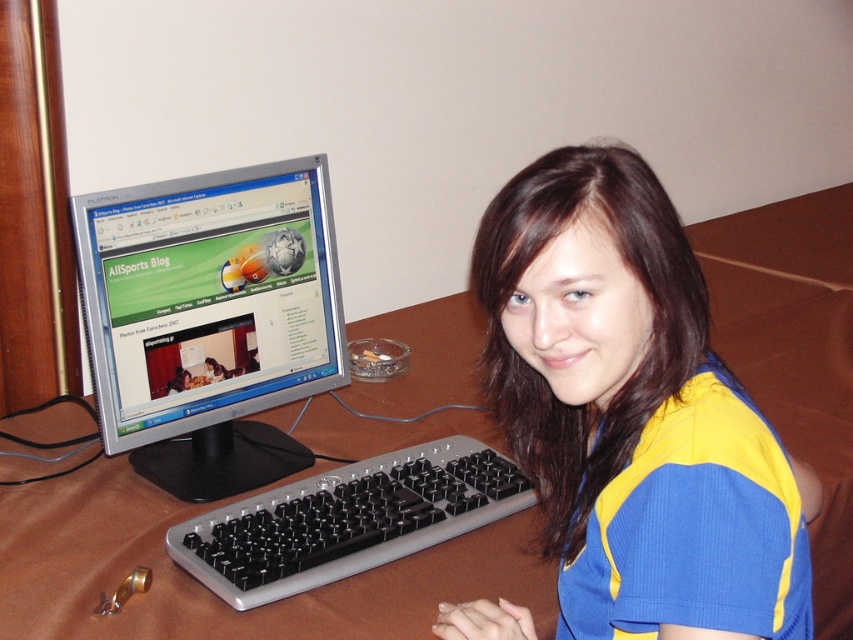
Who is taller, satin silver monitor at center or black plastic keyboard at center?

satin silver monitor at center

Does satin silver monitor at center have a greater width compared to black plastic keyboard at center?

No.

Measure the distance between point (134, 246) and camera.

Point (134, 246) is 1.14 meters from camera.

Identify the location of satin silver monitor at center. This screenshot has height=640, width=853. (210, 320).

Between blue/yellow jersey at center and satin silver monitor at center, which one appears on the left side from the viewer's perspective?

satin silver monitor at center is more to the left.

Does blue/yellow jersey at center have a smaller size compared to satin silver monitor at center?

Actually, blue/yellow jersey at center might be larger than satin silver monitor at center.

Where is `blue/yellow jersey at center`? blue/yellow jersey at center is located at coordinates (630, 410).

The height and width of the screenshot is (640, 853). In order to click on blue/yellow jersey at center in this screenshot , I will do `click(630, 410)`.

Does brown wooden computer desk at center have a lesser height compared to satin silver monitor at center?

In fact, brown wooden computer desk at center may be taller than satin silver monitor at center.

Based on the photo, is brown wooden computer desk at center wider than satin silver monitor at center?

Yes, brown wooden computer desk at center is wider than satin silver monitor at center.

Does point (149, 556) come farther from viewer compared to point (225, 371)?

No, it is in front of (225, 371).

Find the location of a particular element. The height and width of the screenshot is (640, 853). brown wooden computer desk at center is located at coordinates (207, 589).